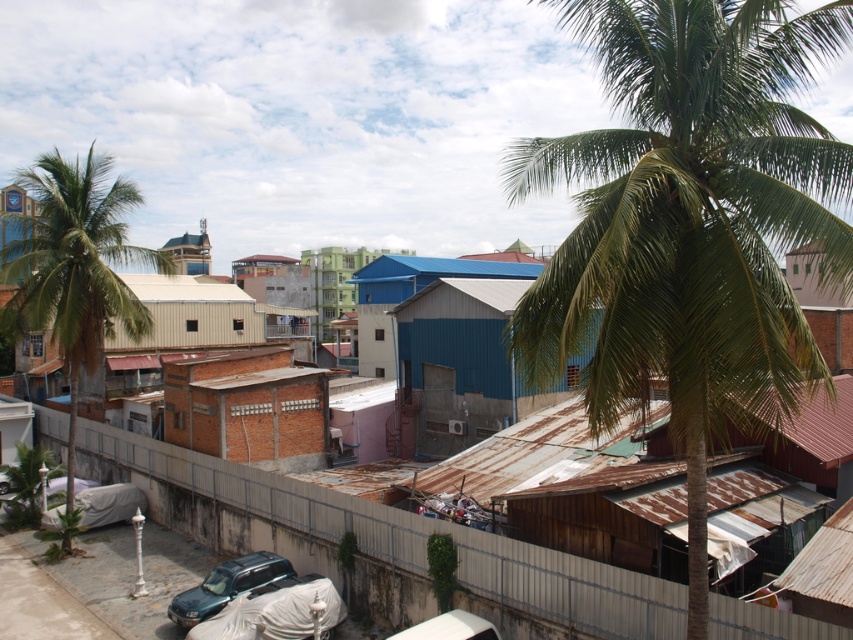
The width and height of the screenshot is (853, 640). What do you see at coordinates (74, 268) in the screenshot?
I see `green leafy palm tree at left` at bounding box center [74, 268].

Which is behind, point (105, 220) or point (187, 609)?

Positioned behind is point (105, 220).

Does point (105, 310) come farther from viewer compared to point (279, 579)?

Yes, it is behind point (279, 579).

The height and width of the screenshot is (640, 853). In order to click on green leafy palm tree at left in this screenshot , I will do `click(74, 268)`.

Is green leafy palm tree at upper right to the right of metallic dark green suv at lower left from the viewer's perspective?

Indeed, green leafy palm tree at upper right is positioned on the right side of metallic dark green suv at lower left.

Measure the distance between point (821, 198) and camera.

32.77 feet

This screenshot has width=853, height=640. In order to click on green leafy palm tree at upper right in this screenshot , I will do `click(689, 224)`.

Which is above, green leafy palm tree at upper right or brown brick hut at center?

green leafy palm tree at upper right is higher up.

Is point (514, 147) positioned before point (195, 401)?

No, it is not.

The width and height of the screenshot is (853, 640). I want to click on green leafy palm tree at upper right, so click(689, 224).